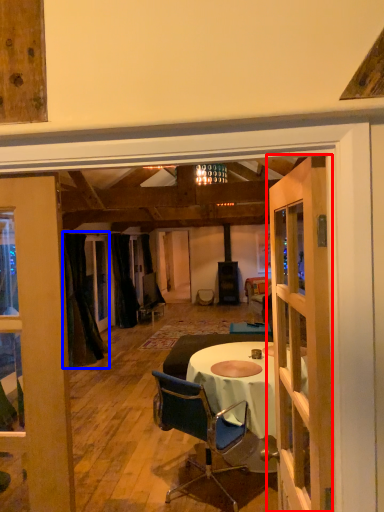
Question: Among these objects, which one is farthest to the camera, door (highlighted by a red box) or curtain (highlighted by a blue box)?

Choices:
 (A) door
 (B) curtain

Answer: (B)